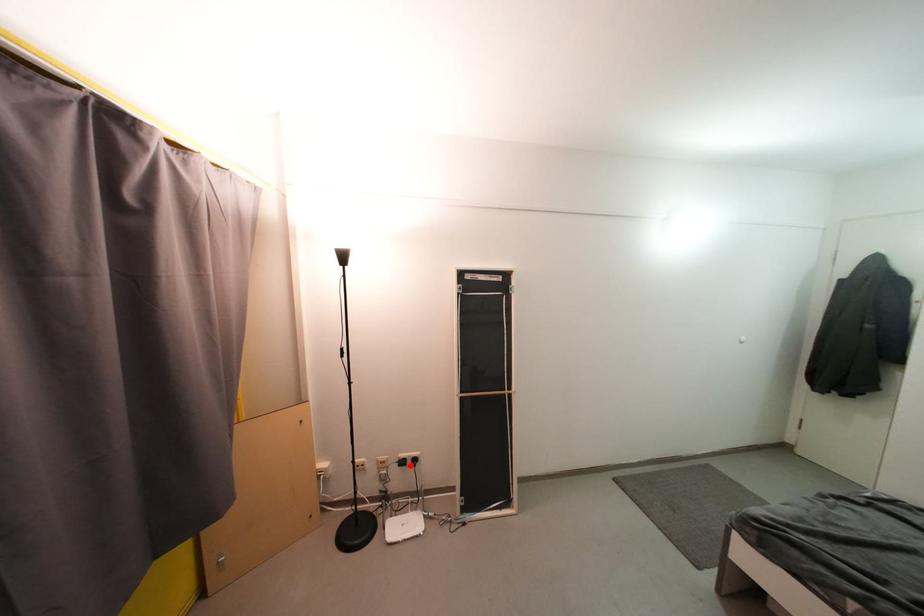
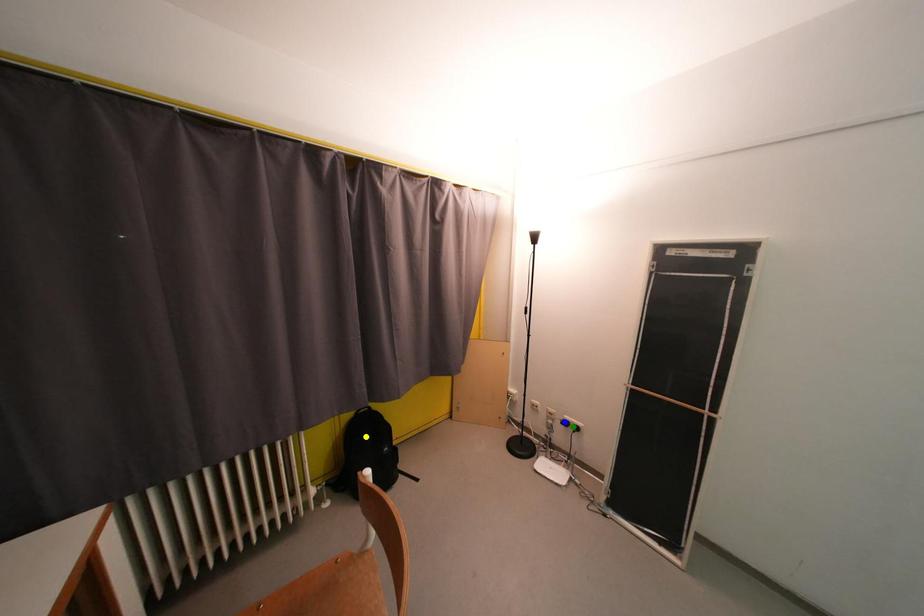
Question: I am providing you with two images of the same scene from different viewpoints. A red point is marked on the first image. You are given multiple points on the second image. Which spot in image 2 lines up with the point in image 1?

Choices:
 (A) blue point
 (B) yellow point
 (C) green point

Answer: (C)